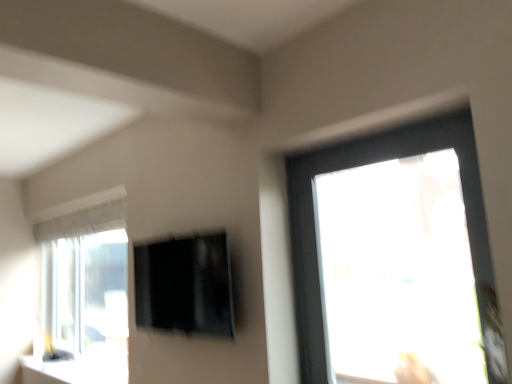
The width and height of the screenshot is (512, 384). What do you see at coordinates (75, 370) in the screenshot?
I see `white glossy window sill at lower left` at bounding box center [75, 370].

Locate an element on the screen. The image size is (512, 384). white glossy window sill at lower left is located at coordinates (75, 370).

What do you see at coordinates (185, 285) in the screenshot? The width and height of the screenshot is (512, 384). I see `black glossy screen at center` at bounding box center [185, 285].

What is the approximate height of black glossy screen at center?

The height of black glossy screen at center is 18.27 inches.

Locate an element on the screen. Image resolution: width=512 pixels, height=384 pixels. black glossy screen at center is located at coordinates (185, 285).

Where is `white glossy window sill at lower left`? white glossy window sill at lower left is located at coordinates (75, 370).

Which object is positioned more to the left, black glossy screen at center or white glossy window sill at lower left?

white glossy window sill at lower left.

Which is behind, black glossy screen at center or white glossy window sill at lower left?

white glossy window sill at lower left is more distant.

Between point (216, 306) and point (106, 372), which one is positioned in front?

The point (216, 306) is in front.

From the image's perspective, which is above, black glossy screen at center or white glossy window sill at lower left?

black glossy screen at center, from the image's perspective.

From a real-world perspective, is black glossy screen at center physically located above or below white glossy window sill at lower left?

In terms of real-world spatial position, black glossy screen at center is above white glossy window sill at lower left.

Is black glossy screen at center wider than white glossy window sill at lower left?

In fact, black glossy screen at center might be narrower than white glossy window sill at lower left.

Can you confirm if black glossy screen at center is taller than white glossy window sill at lower left?

Yes, black glossy screen at center is taller than white glossy window sill at lower left.

Between black glossy screen at center and white glossy window sill at lower left, which one has larger size?

black glossy screen at center.

Is black glossy screen at center outside of white glossy window sill at lower left?

Indeed, black glossy screen at center is completely outside white glossy window sill at lower left.

Is the surface of black glossy screen at center in direct contact with white glossy window sill at lower left?

No, black glossy screen at center is not making contact with white glossy window sill at lower left.

Does black glossy screen at center turn towards white glossy window sill at lower left?

No, black glossy screen at center does not turn towards white glossy window sill at lower left.

Can you tell me how much black glossy screen at center and white glossy window sill at lower left differ in facing direction?

The angular difference between black glossy screen at center and white glossy window sill at lower left is 0.812 degrees.

Locate an element on the screen. window sill on the left of the black glossy screen at center is located at coordinates (75, 370).

Considering the relative positions of white glossy window sill at lower left and black glossy screen at center in the image provided, is white glossy window sill at lower left to the left or to the right of black glossy screen at center?

From the image, it's evident that white glossy window sill at lower left is to the left of black glossy screen at center.

Does white glossy window sill at lower left come in front of black glossy screen at center?

No, the depth of white glossy window sill at lower left is greater than that of black glossy screen at center.

Does point (77, 372) appear closer or farther from the camera than point (176, 287)?

Point (77, 372) is positioned farther from the camera compared to point (176, 287).

From the image's perspective, is white glossy window sill at lower left above or below black glossy screen at center?

Based on their image positions, white glossy window sill at lower left is located beneath black glossy screen at center.

From a real-world perspective, is white glossy window sill at lower left under black glossy screen at center?

Correct, in the physical world, white glossy window sill at lower left is lower than black glossy screen at center.

Which of these two, white glossy window sill at lower left or black glossy screen at center, is thinner?

Thinner between the two is black glossy screen at center.

Considering the sizes of white glossy window sill at lower left and black glossy screen at center in the image, is white glossy window sill at lower left taller or shorter than black glossy screen at center?

In the image, white glossy window sill at lower left appears to be shorter than black glossy screen at center.

Looking at the image, does white glossy window sill at lower left seem bigger or smaller compared to black glossy screen at center?

Clearly, white glossy window sill at lower left is smaller in size than black glossy screen at center.

Choose the correct answer: Is white glossy window sill at lower left inside black glossy screen at center or outside it?

The correct answer is: outside.

Is white glossy window sill at lower left next to black glossy screen at center?

No, white glossy window sill at lower left is not touching black glossy screen at center.

Is white glossy window sill at lower left oriented towards black glossy screen at center?

No, white glossy window sill at lower left is not turned towards black glossy screen at center.

How many degrees apart are the facing directions of white glossy window sill at lower left and black glossy screen at center?

They differ by 0.812 degrees in their facing directions.

Find the location of `window screen that appears above the white glossy window sill at lower left (from the image's perspective)`. window screen that appears above the white glossy window sill at lower left (from the image's perspective) is located at coordinates (185, 285).

The height and width of the screenshot is (384, 512). I want to click on window screen above the white glossy window sill at lower left (from a real-world perspective), so click(x=185, y=285).

Where is `window sill behind the black glossy screen at center`? The image size is (512, 384). window sill behind the black glossy screen at center is located at coordinates (75, 370).